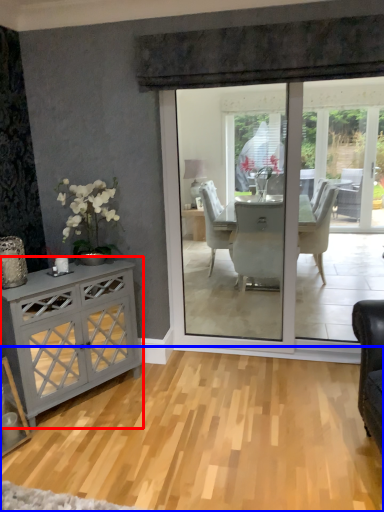
Question: Which object is further to the camera taking this photo, cabinetry (highlighted by a red box) or plain (highlighted by a blue box)?

Choices:
 (A) cabinetry
 (B) plain

Answer: (A)